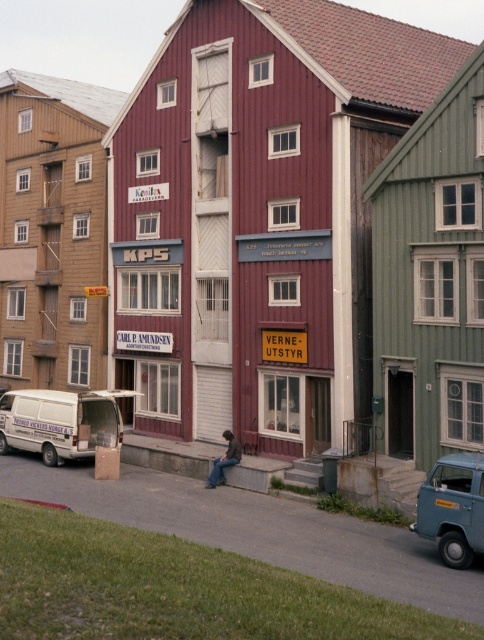
Question: Which object is farther from the camera taking this photo?

Choices:
 (A) dark blue jeans at center
 (B) white matte van at lower left

Answer: (B)

Question: Does blue matte minivan at lower right appear on the left side of dark blue jeans at center?

Choices:
 (A) no
 (B) yes

Answer: (A)

Question: Which point is closer to the camera?

Choices:
 (A) gray concrete curb at lower center
 (B) white matte van at lower left

Answer: (A)

Question: Is white matte van at lower left bigger than blue matte minivan at lower right?

Choices:
 (A) no
 (B) yes

Answer: (A)

Question: Does blue matte minivan at lower right appear over gray concrete curb at lower center?

Choices:
 (A) yes
 (B) no

Answer: (A)

Question: Which point is farther from the camera taking this photo?

Choices:
 (A) (218, 483)
 (B) (474, 550)
 (C) (56, 448)
 (D) (244, 460)

Answer: (C)